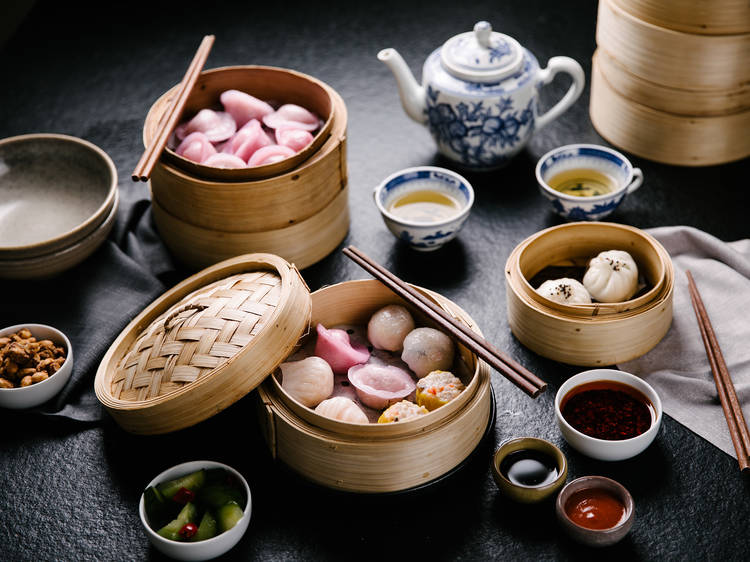
What are the coordinates of `cloth napkin` in the screenshot? It's located at (740, 300).